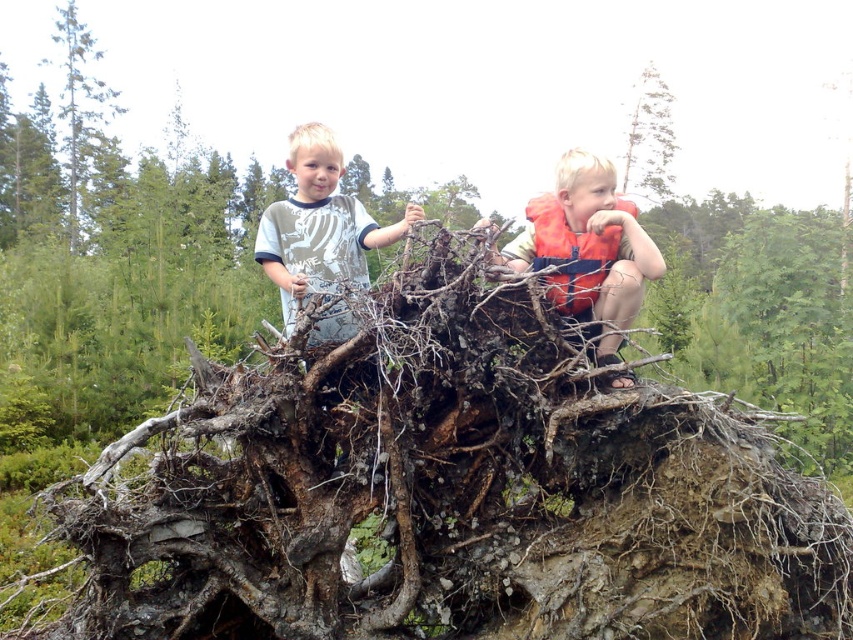
Question: Which of these objects is positioned farthest from the smooth bark tree at upper right?

Choices:
 (A) orange life vest at center
 (B) matte gray t-shirt at upper left
 (C) green rough bark tree at upper left
 (D) brown rough tree roots at center

Answer: (B)

Question: Is green rough bark tree at upper left to the right of smooth bark tree at upper right from the viewer's perspective?

Choices:
 (A) no
 (B) yes

Answer: (A)

Question: Can you confirm if orange life vest at center is positioned above matte gray t-shirt at upper left?

Choices:
 (A) yes
 (B) no

Answer: (B)

Question: Which object is closer to the camera taking this photo?

Choices:
 (A) matte gray t-shirt at upper left
 (B) brown rough tree roots at center

Answer: (B)

Question: Can you confirm if orange life vest at center is wider than matte gray t-shirt at upper left?

Choices:
 (A) yes
 (B) no

Answer: (A)

Question: Which point is farther to the camera?

Choices:
 (A) (107, 93)
 (B) (782, 282)
 (C) (340, 314)

Answer: (A)